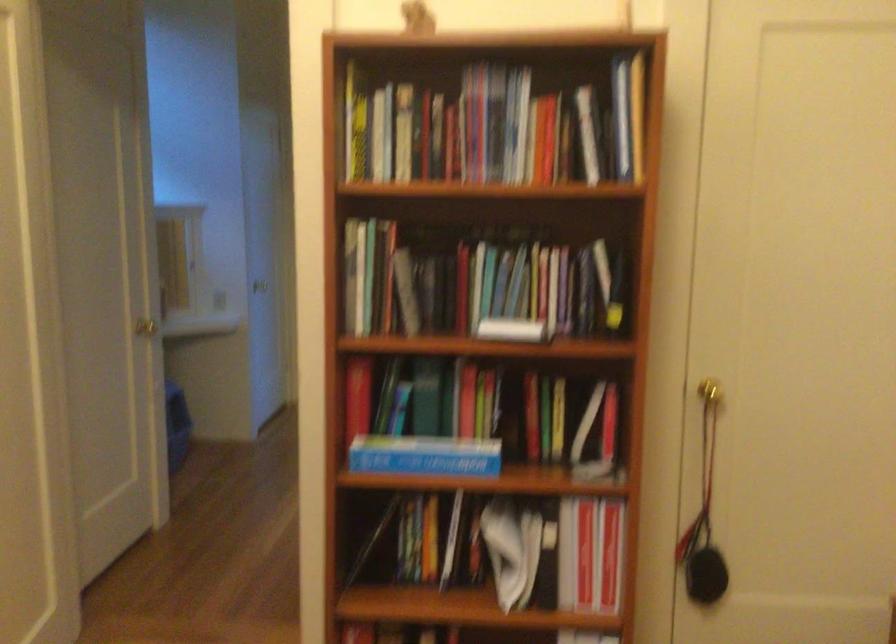
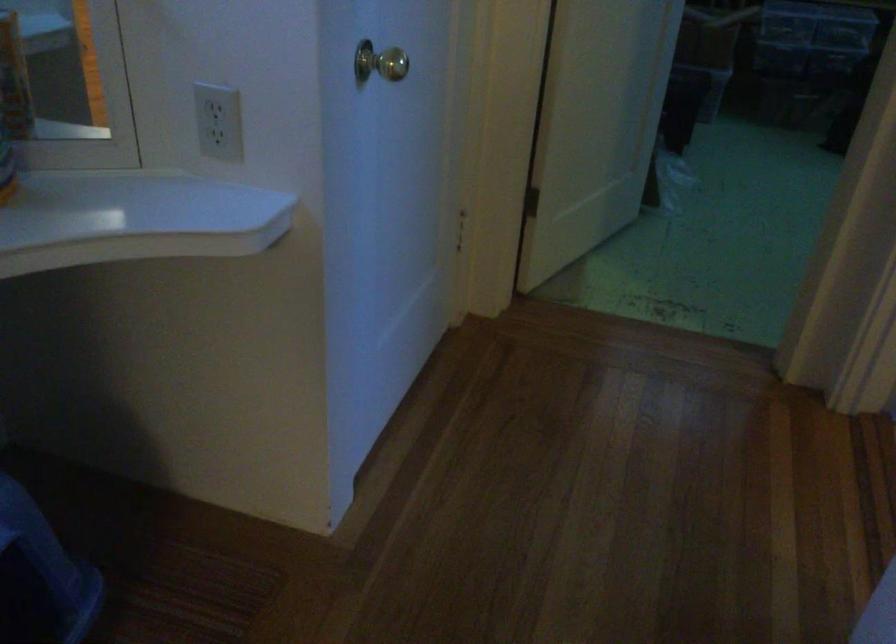
Question: In a continuous first-person perspective shot, in which direction is the camera moving?

Choices:
 (A) Left
 (B) Right
 (C) Forward
 (D) Backward

Answer: (C)